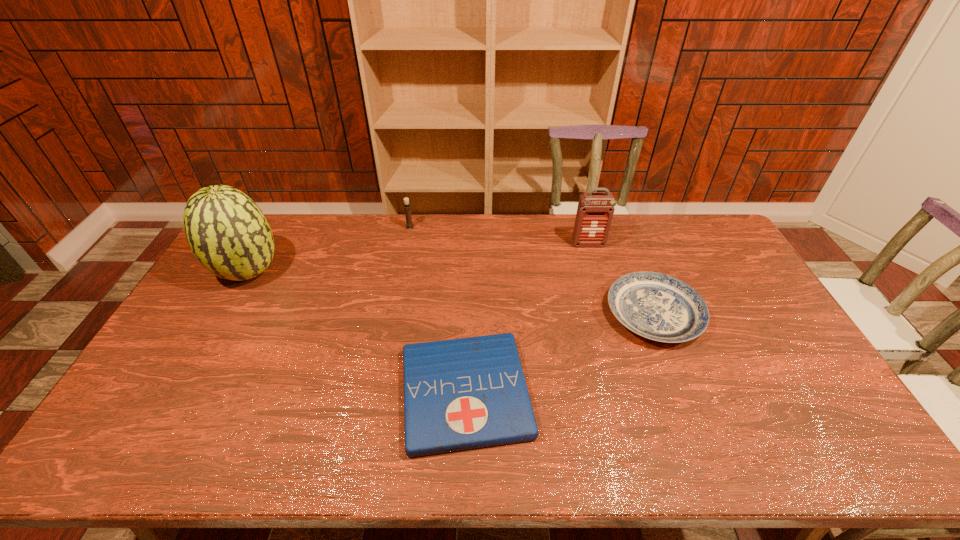
Locate an element on the screen. vacant space that satisfies the following two spatial constraints: 1. on the back side of the farthest object; 2. on the right side of the tallest object is located at coordinates (x=275, y=227).

The image size is (960, 540). Find the location of `vacant space that satisfies the following two spatial constraints: 1. on the front-facing side of the taller first-aid kit; 2. on the right side of the plate`. vacant space that satisfies the following two spatial constraints: 1. on the front-facing side of the taller first-aid kit; 2. on the right side of the plate is located at coordinates (609, 314).